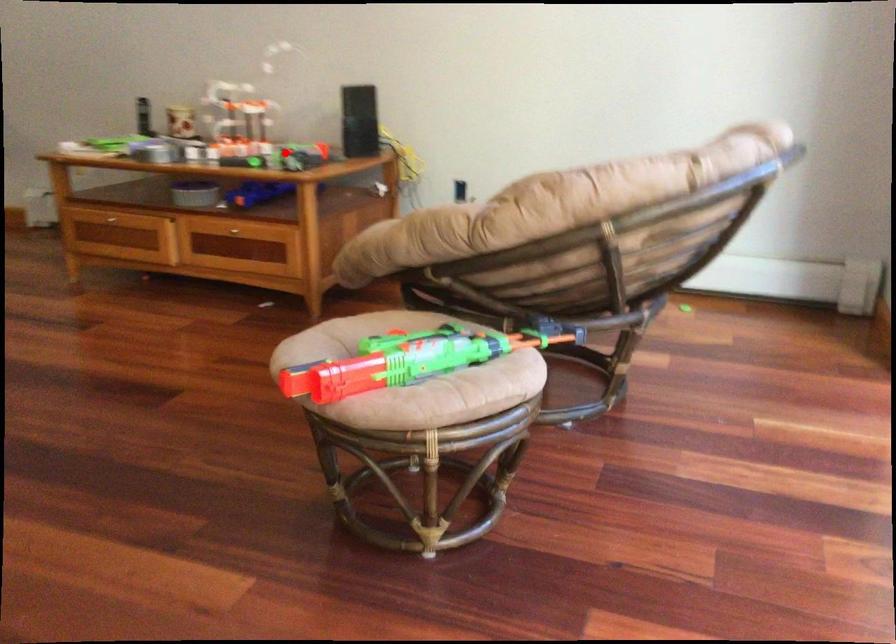
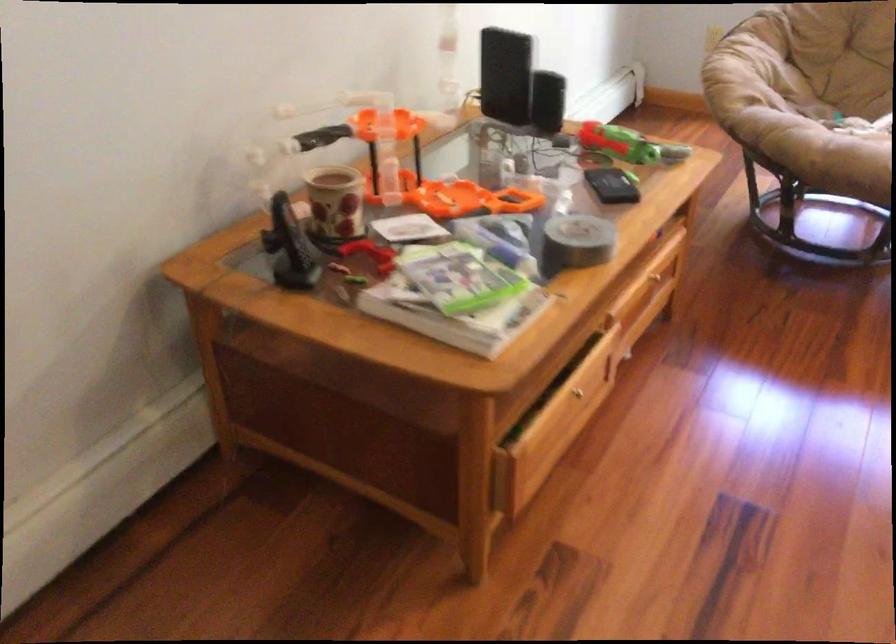
The point at the highlighted location is marked in the first image. Where is the corresponding point in the second image?

(627, 145)